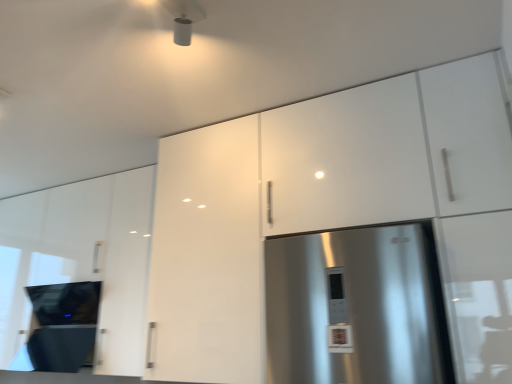
Question: Would you say white glossy cabinet at center, which appears as the second cabinetry when viewed from the left, is part of white glossy cabinet at upper right, positioned as the 1th cabinetry in right-to-left order,'s contents?

Choices:
 (A) no
 (B) yes

Answer: (A)

Question: Considering the relative positions of white glossy cabinet at upper right, which appears as the third cabinetry when viewed from the left, and white glossy cabinet at center, which is the second cabinetry from right to left, in the image provided, is white glossy cabinet at upper right, which appears as the third cabinetry when viewed from the left, behind white glossy cabinet at center, which is the second cabinetry from right to left,?

Choices:
 (A) yes
 (B) no

Answer: (B)

Question: Are white glossy cabinet at upper right, which appears as the third cabinetry when viewed from the left, and white glossy cabinet at center, which appears as the second cabinetry when viewed from the left, far apart?

Choices:
 (A) no
 (B) yes

Answer: (A)

Question: Is white glossy cabinet at upper right, positioned as the 1th cabinetry in right-to-left order, smaller than white glossy cabinet at center, which appears as the second cabinetry when viewed from the left?

Choices:
 (A) no
 (B) yes

Answer: (A)

Question: Can you confirm if white glossy cabinet at upper right, positioned as the 1th cabinetry in right-to-left order, is shorter than white glossy cabinet at center, which is the second cabinetry from right to left?

Choices:
 (A) no
 (B) yes

Answer: (B)

Question: From a real-world perspective, is glossy white cabinet at upper left, positioned as the third cabinetry in right-to-left order, positioned above or below white glossy cabinet at upper right, which appears as the third cabinetry when viewed from the left?

Choices:
 (A) below
 (B) above

Answer: (A)

Question: In terms of height, does glossy white cabinet at upper left, acting as the 1th cabinetry starting from the left, look taller or shorter compared to white glossy cabinet at upper right, positioned as the 1th cabinetry in right-to-left order?

Choices:
 (A) short
 (B) tall

Answer: (A)

Question: Does point (56, 274) appear closer or farther from the camera than point (182, 140)?

Choices:
 (A) farther
 (B) closer

Answer: (A)

Question: Which is correct: glossy white cabinet at upper left, positioned as the third cabinetry in right-to-left order, is inside white glossy cabinet at upper right, which appears as the third cabinetry when viewed from the left, or outside of it?

Choices:
 (A) inside
 (B) outside

Answer: (B)

Question: From a real-world perspective, is glossy white cabinet at upper left, acting as the 1th cabinetry starting from the left, above or below black glass cooktop at lower left?

Choices:
 (A) below
 (B) above

Answer: (B)

Question: Considering the positions of glossy white cabinet at upper left, positioned as the third cabinetry in right-to-left order, and black glass cooktop at lower left in the image, is glossy white cabinet at upper left, positioned as the third cabinetry in right-to-left order, taller or shorter than black glass cooktop at lower left?

Choices:
 (A) short
 (B) tall

Answer: (B)

Question: Considering the relative positions of glossy white cabinet at upper left, positioned as the third cabinetry in right-to-left order, and black glass cooktop at lower left in the image provided, is glossy white cabinet at upper left, positioned as the third cabinetry in right-to-left order, to the left or to the right of black glass cooktop at lower left?

Choices:
 (A) right
 (B) left

Answer: (B)

Question: Is glossy white cabinet at upper left, acting as the 1th cabinetry starting from the left, inside or outside of black glass cooktop at lower left?

Choices:
 (A) inside
 (B) outside

Answer: (B)

Question: Considering the positions of point (205, 254) and point (81, 301), is point (205, 254) closer or farther from the camera than point (81, 301)?

Choices:
 (A) farther
 (B) closer

Answer: (B)

Question: From the image's perspective, is white glossy cabinet at center, which appears as the second cabinetry when viewed from the left, positioned above or below black glass cooktop at lower left?

Choices:
 (A) below
 (B) above

Answer: (B)